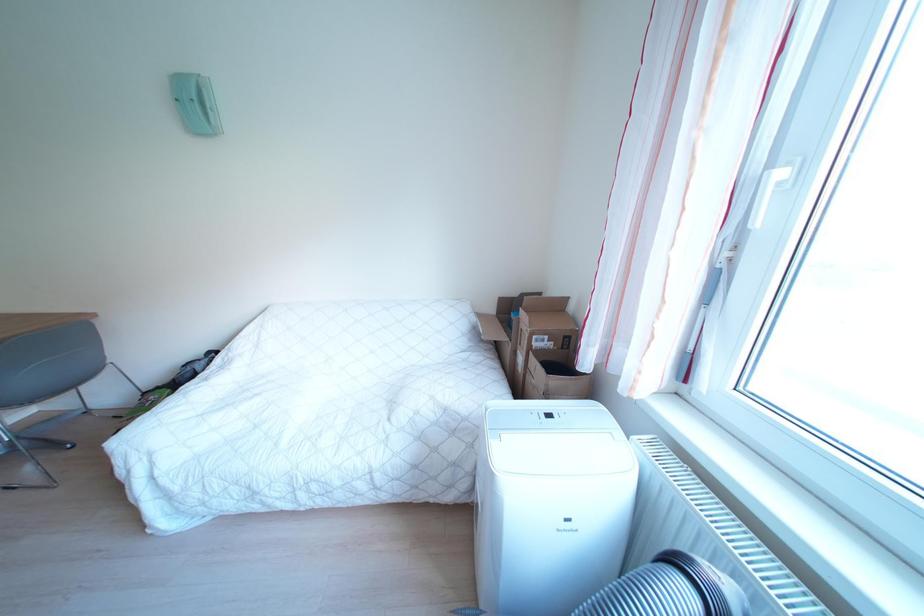
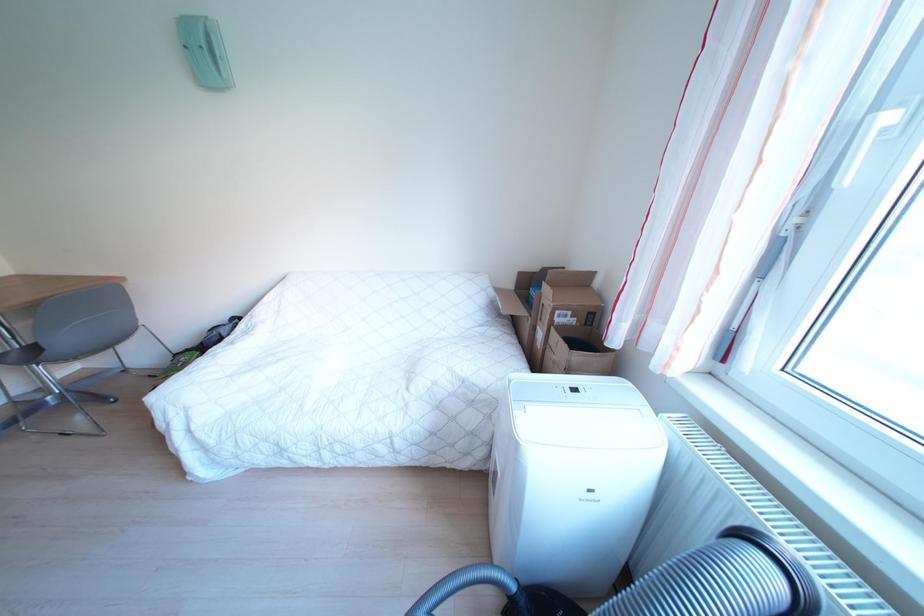
Question: Based on the continuous images, in which direction is the camera rotating? Reply with the corresponding letter.

Choices:
 (A) Left
 (B) Right
 (C) Up
 (D) Down

Answer: (D)